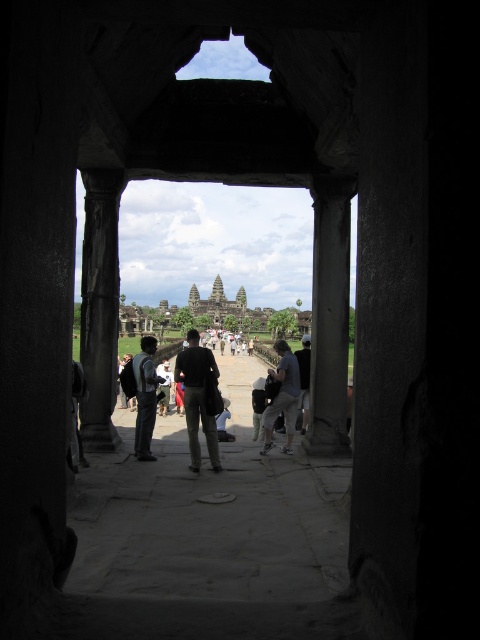
You are a tour guide holding a 200 feet long rope. You want to measure the distance between you and the dark green uniform at center. Can you determine if the rope is long enough?

The distance between you and the dark green uniform at center is 243.35 feet, so the 200 feet long rope is not long enough to measure the distance.

You are a photographer standing in front of the ancient temple archway. You notice two visitors wearing light gray fabric pants at center and dark gray pants at center. If you want to capture both pairs of pants in a single photo without moving the subjects, which pants should you focus on to ensure both are fully visible in the frame?

You should focus on the light gray fabric pants at center since they have a lesser width compared to the dark gray pants at center, making them easier to fit within the frame.

You are standing in front of the stone archway at Angkor Wat and want to take a photo that includes both the dark gray stone pillar at center and the distant temple complex. Based on their positions, where should you position yourself to ensure both elements are in the frame?

The dark gray stone pillar at center is located at point (330, 316), which is near the center of the archway. To include both the pillar and the distant temple complex in your photo, position yourself centrally in front of the archway so that the pillar is centered and the background remains visible through the archway opening.